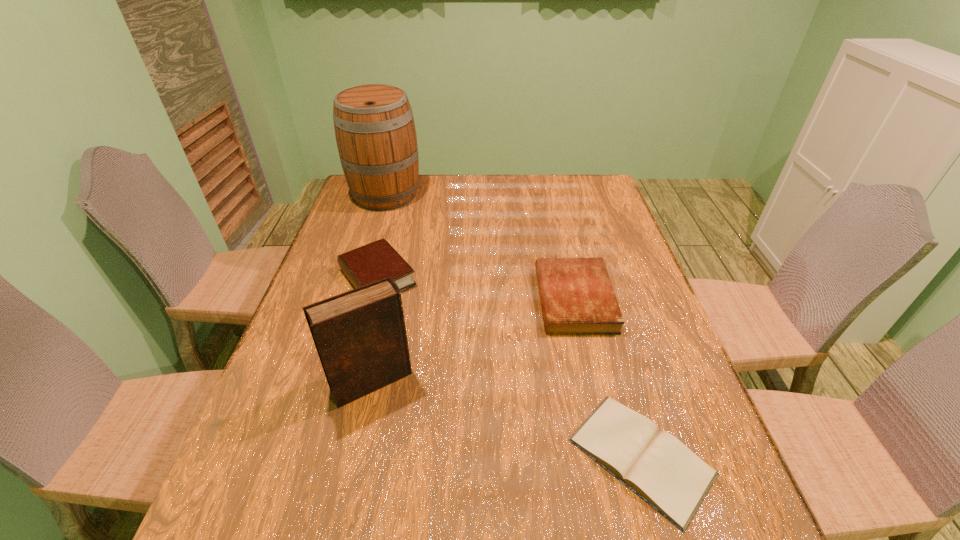
Locate an element on the screen. This screenshot has width=960, height=540. vacant area between the tallest object and the third shortest object is located at coordinates (381, 236).

Identify the location of vacant area between the shortest Bible and the second tallest object. This screenshot has width=960, height=540. (507, 419).

Where is `object that is the second closest to the third shortest Bible`? This screenshot has height=540, width=960. object that is the second closest to the third shortest Bible is located at coordinates (375, 132).

Choose which object is the fourth nearest neighbor to the second tallest object. Please provide its 2D coordinates. Your answer should be formatted as a tuple, i.e. [(x, y)], where the tuple contains the x and y coordinates of a point satisfying the conditions above.

[(375, 132)]

Locate an element on the screen. Bible object that ranks as the third closest to the shortest object is located at coordinates (377, 260).

Where is `Bible that stands as the third closest to the tallest Bible`? This screenshot has width=960, height=540. Bible that stands as the third closest to the tallest Bible is located at coordinates (655, 465).

I want to click on free space that satisfies the following two spatial constraints: 1. on the spine side of the second shortest object; 2. on the front side of the second tallest object, so click(x=593, y=381).

Where is `vacant region that satisfies the following two spatial constraints: 1. on the front side of the shortest Bible; 2. on the left side of the farthest object`? vacant region that satisfies the following two spatial constraints: 1. on the front side of the shortest Bible; 2. on the left side of the farthest object is located at coordinates (304, 456).